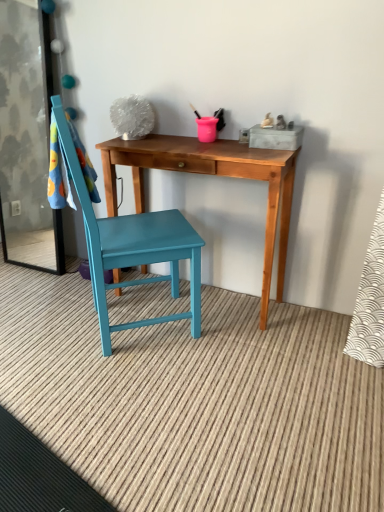
Where is `vacant space situated on the left part of teal painted wood chair at center`? vacant space situated on the left part of teal painted wood chair at center is located at coordinates (45, 322).